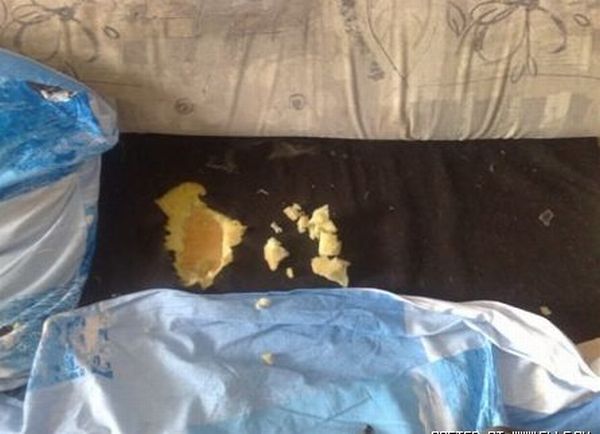
The width and height of the screenshot is (600, 434). In order to click on blue fabric on top of box in this screenshot , I will do `click(29, 130)`.